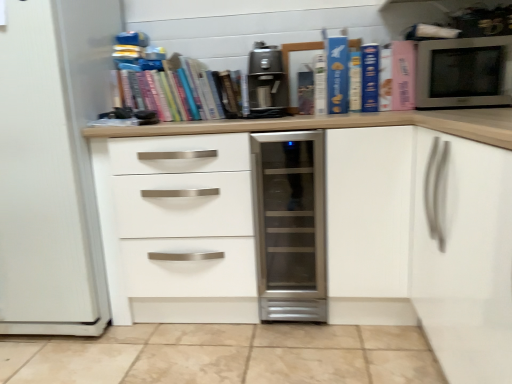
Locate an element on the screen. The height and width of the screenshot is (384, 512). space that is in front of blue matte book at upper center, acting as the fifth paperback book starting from the left is located at coordinates (376, 112).